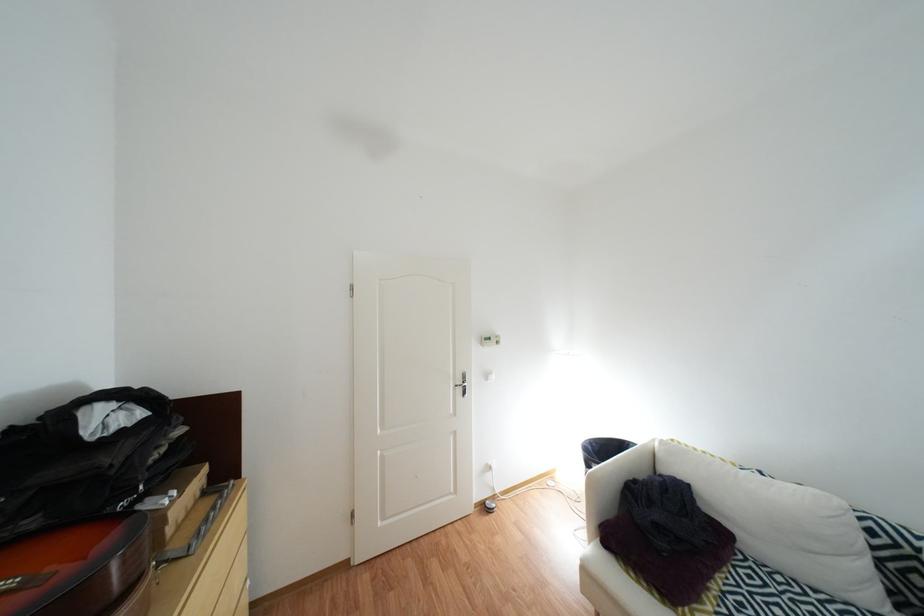
Find where to sit the sofa sitting surface. Please return your answer as a coordinate pair (x, y).

(772, 594)